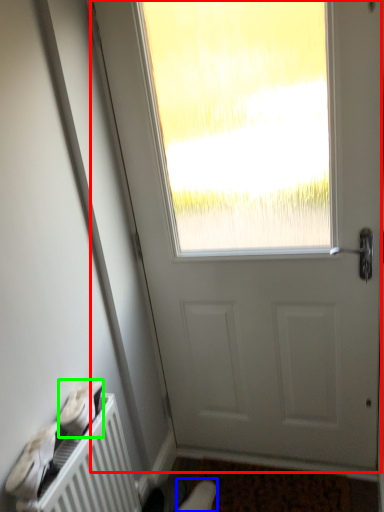
Question: Which is nearer to the door (highlighted by a red box)? shoe (highlighted by a blue box) or shoe (highlighted by a green box).

Choices:
 (A) shoe
 (B) shoe

Answer: (B)